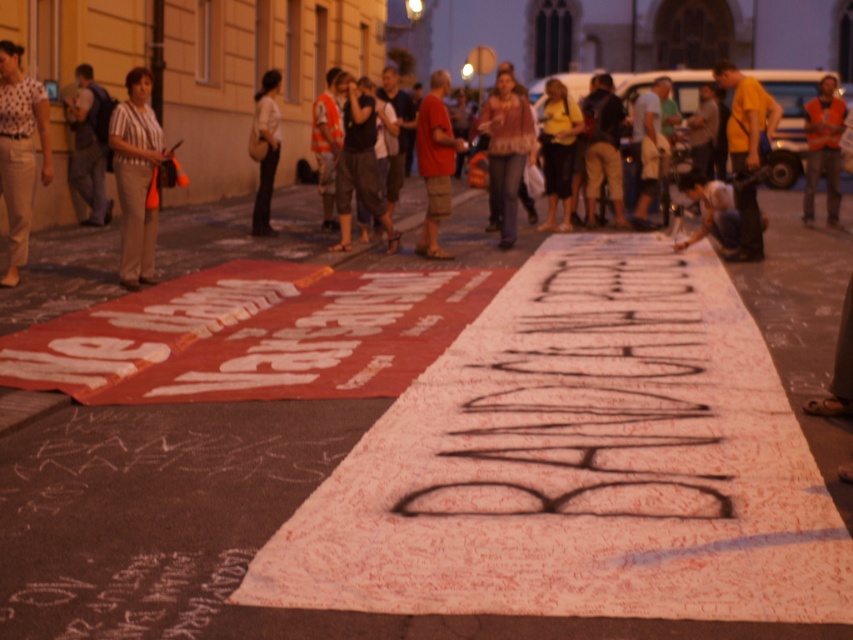
You are a photographer standing in the center of the square. You want to capture a photo of the light beige pants at left. Where should you position your camera to ensure the pants are centered in the frame?

To center the light beige pants at left in the frame, position your camera at point (19, 150).

You are a photographer standing in the public square and want to take a photo of the white paper at center and the dark gray backpack at left. According to the scene description, which object should you focus on first if you want to capture both in one frame without moving your camera?

The white paper at center is to the right of dark gray backpack at left, so you should focus on the dark gray backpack at left first to ensure both objects are in the frame without moving the camera.

You are a photographer standing in the middle of the square. You want to take a photo of the white paper at center and the dark gray backpack at left. Which object will appear closer to the camera in the photo?

The white paper at center will appear closer to the camera in the photo because it is in front of the dark gray backpack at left.